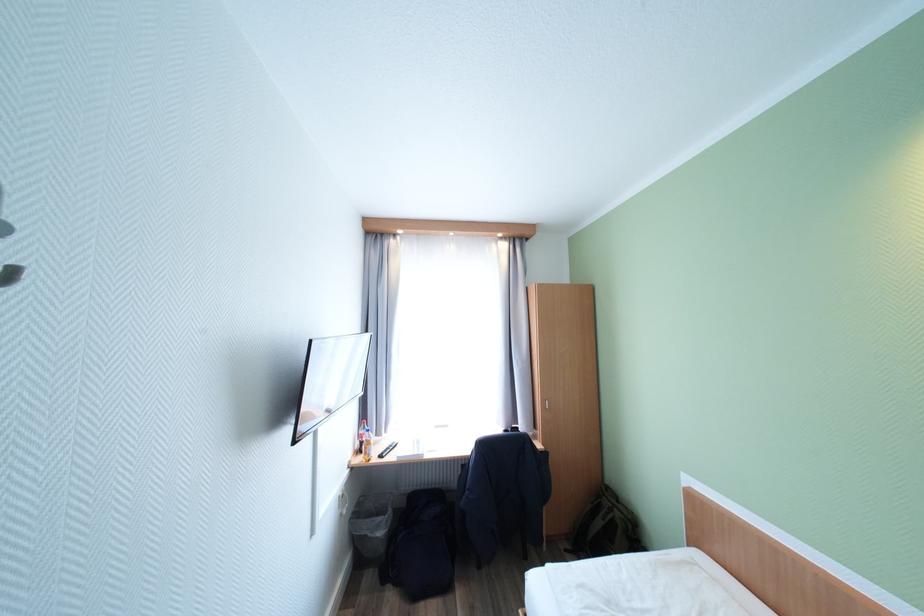
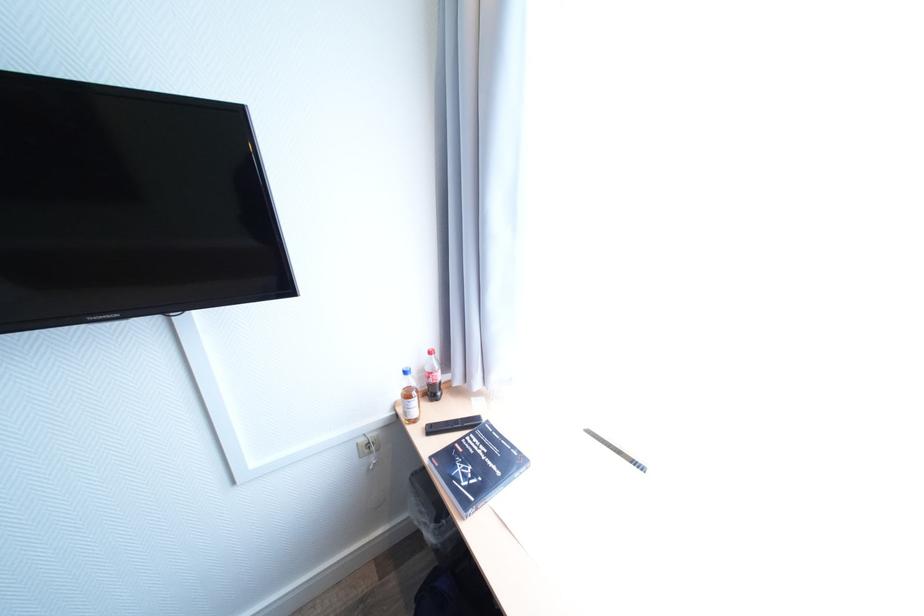
Where in the second image is the point corresponding to (357,463) from the first image?

(403, 403)